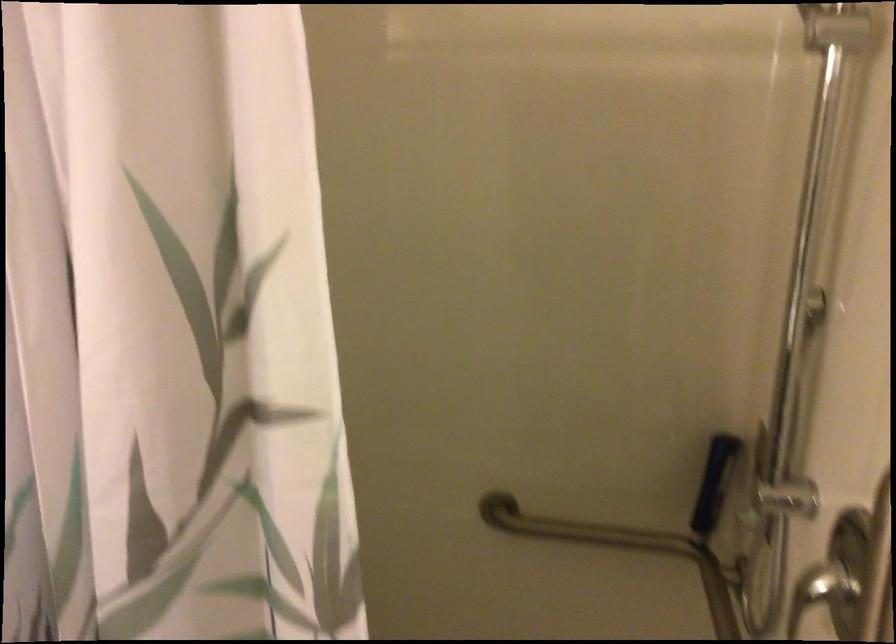
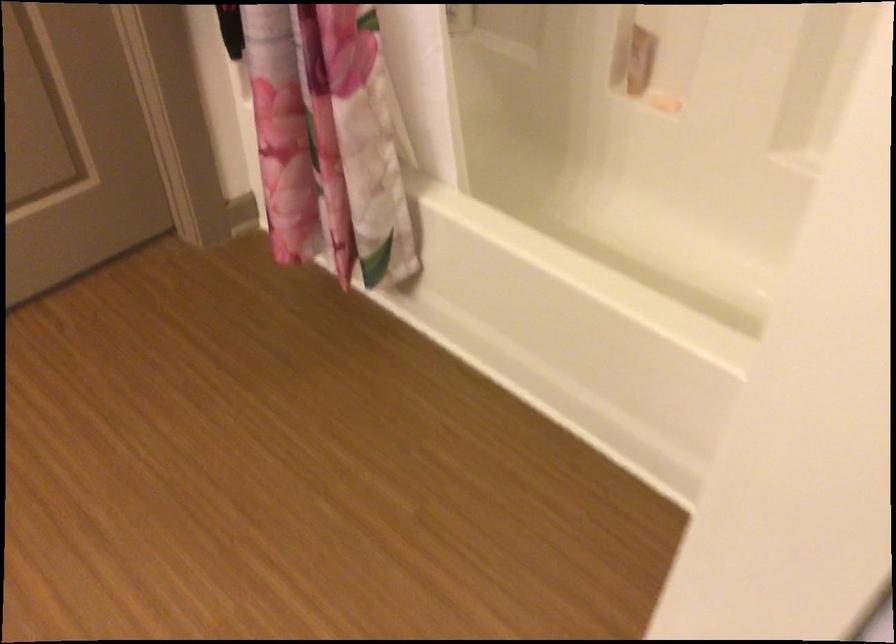
How did the camera likely rotate?

The rotation direction of the camera is left-down.